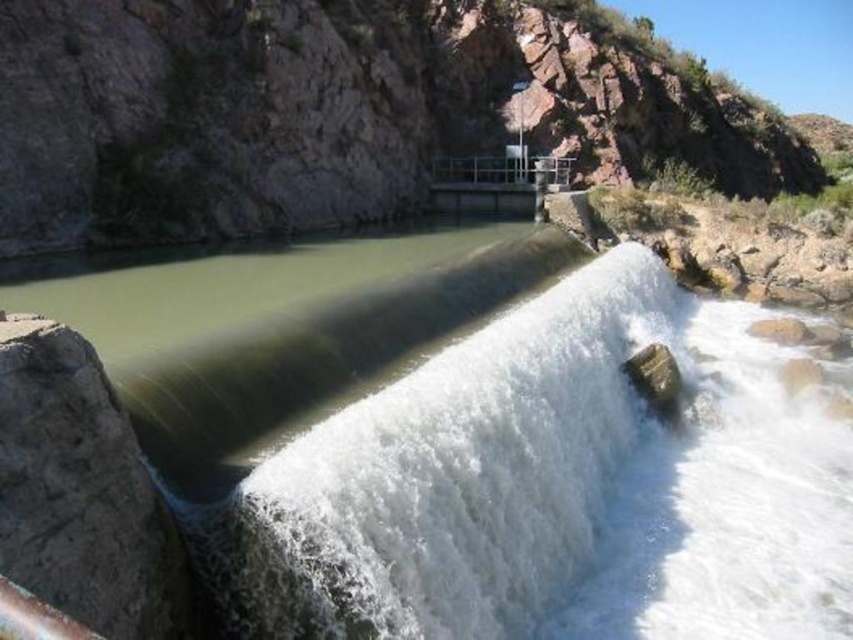
Question: From the image, what is the correct spatial relationship of white frothy water at center in relation to brown rough stone at lower left?

Choices:
 (A) above
 (B) below

Answer: (A)

Question: Which object appears farthest from the camera in this image?

Choices:
 (A) brown rough stone at lower left
 (B) white frothy water at center

Answer: (B)

Question: Is white frothy water at center in front of brown rough stone at lower left?

Choices:
 (A) yes
 (B) no

Answer: (B)

Question: Which point appears farthest from the camera in this image?

Choices:
 (A) (102, 426)
 (B) (572, 378)

Answer: (B)

Question: Can you confirm if white frothy water at center is wider than brown rough stone at lower left?

Choices:
 (A) yes
 (B) no

Answer: (A)

Question: Which point appears closest to the camera in this image?

Choices:
 (A) (62, 544)
 (B) (627, 536)

Answer: (A)